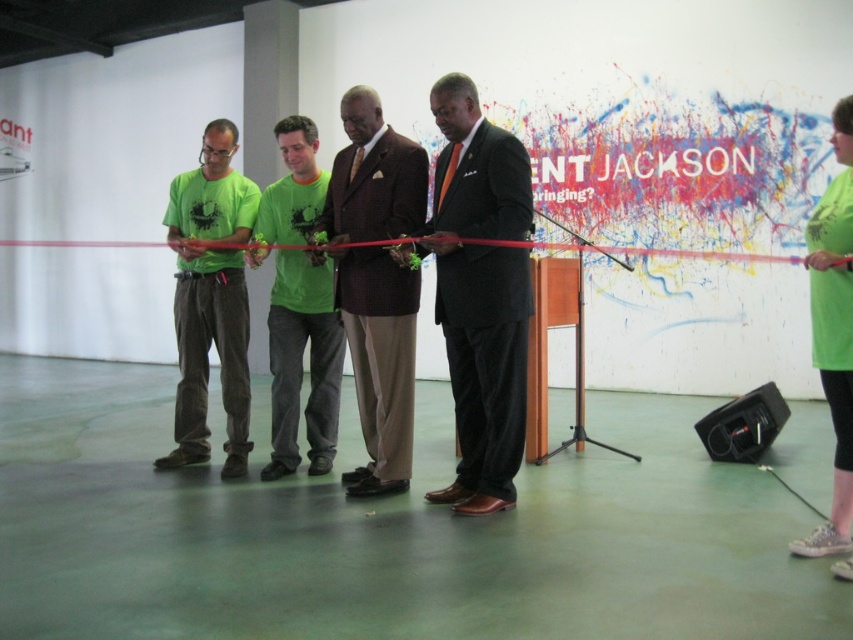
Who is more distant from viewer, (x=459, y=500) or (x=813, y=356)?

Point (x=459, y=500)

Which is in front, point (527, 212) or point (844, 168)?

Point (527, 212) is in front.

At what (x,y) coordinates should I click in order to perform the action: click on black satin suit at center. Please return your answer as a coordinate pair (x, y). This screenshot has height=640, width=853. Looking at the image, I should click on (480, 292).

Is green corduroy pants at left shorter than green fabric shirt at center?

No.

Does green corduroy pants at left appear over green fabric shirt at center?

Yes.

Where is `green corduroy pants at left`? green corduroy pants at left is located at coordinates (210, 298).

At what (x,y) coordinates should I click in order to perform the action: click on green corduroy pants at left. Please return your answer as a coordinate pair (x, y). Looking at the image, I should click on (210, 298).

Between point (445, 198) and point (312, 212), which one is positioned in front?

Point (445, 198) is more forward.

Between black satin suit at center and green fabric shirt at center, which one has less height?

With less height is green fabric shirt at center.

What do you see at coordinates (480, 292) in the screenshot?
I see `black satin suit at center` at bounding box center [480, 292].

Identify the location of black satin suit at center. (480, 292).